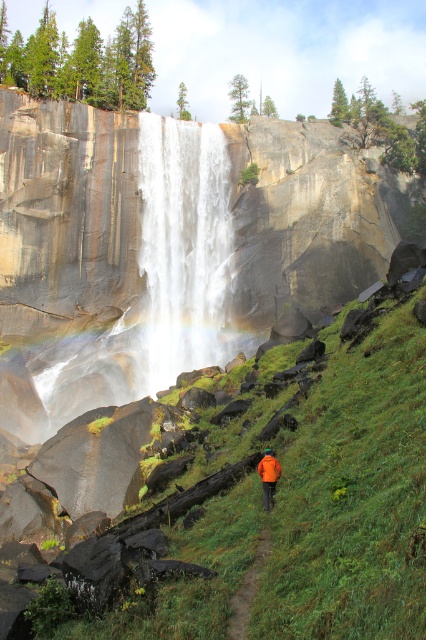
Is white translucent water at center taller than orange fabric jacket at center?

Indeed, white translucent water at center has a greater height compared to orange fabric jacket at center.

Is white translucent water at center above orange fabric jacket at center?

Correct, white translucent water at center is located above orange fabric jacket at center.

Measure the distance between point (180,362) and camera.

Point (180,362) and camera are 69.44 meters apart from each other.

Where is `white translucent water at center`? white translucent water at center is located at coordinates (184, 244).

Is green grassy trail at lower center shorter than orange fabric jacket at center?

Yes, green grassy trail at lower center is shorter than orange fabric jacket at center.

Between green grassy trail at lower center and orange fabric jacket at center, which one is positioned lower?

green grassy trail at lower center is below.

Which is behind, point (233, 604) or point (270, 477)?

Point (270, 477)

Where is `green grassy trail at lower center`? The height and width of the screenshot is (640, 426). green grassy trail at lower center is located at coordinates click(247, 588).

Is white translucent water at center bigger than green grassy trail at lower center?

Yes, white translucent water at center is bigger than green grassy trail at lower center.

Who is positioned more to the left, white translucent water at center or green grassy trail at lower center?

Positioned to the left is white translucent water at center.

Is point (140, 257) more distant than point (264, 561)?

Yes, point (140, 257) is behind point (264, 561).

This screenshot has width=426, height=640. I want to click on white translucent water at center, so pos(184,244).